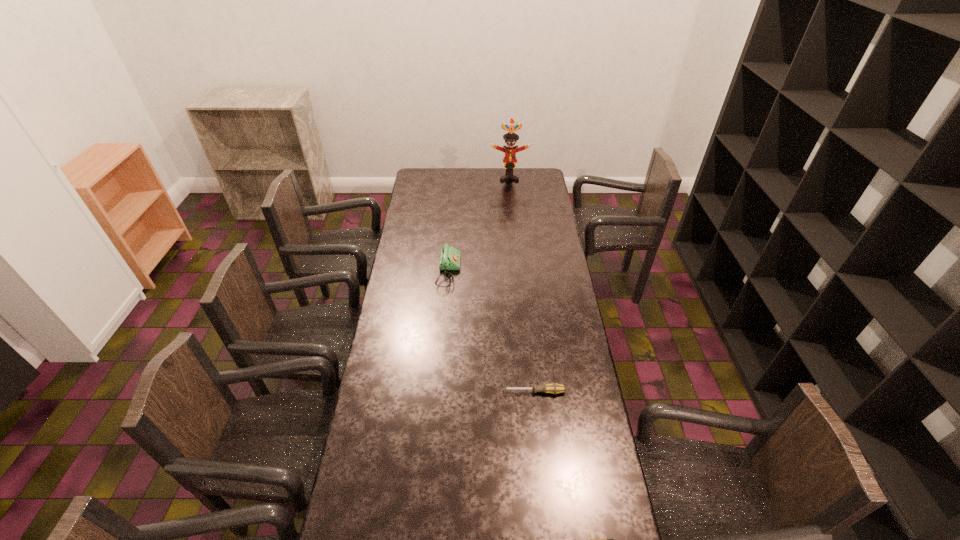
In order to click on the farthest object in this screenshot , I will do `click(509, 161)`.

This screenshot has width=960, height=540. Identify the location of the tallest object. (509, 161).

At what (x,y) coordinates should I click in order to perform the action: click on the leftmost object. Please return your answer as a coordinate pair (x, y). Looking at the image, I should click on (449, 257).

This screenshot has height=540, width=960. Identify the location of telephone. (449, 257).

I want to click on the farther screwdriver, so click(554, 388).

This screenshot has height=540, width=960. I want to click on the third tallest object, so click(554, 388).

This screenshot has height=540, width=960. I want to click on vacant area situated 0.290m on the front-facing side of the farthest object, so click(x=513, y=210).

Find the location of `vacant space situated 0.350m on the dial of the third nearest object`. vacant space situated 0.350m on the dial of the third nearest object is located at coordinates (538, 272).

Where is `free region located 0.110m at the tip of the second shortest object`? The image size is (960, 540). free region located 0.110m at the tip of the second shortest object is located at coordinates (471, 392).

This screenshot has width=960, height=540. What are the coordinates of `vacant area situated 0.110m at the tip of the second shortest object` in the screenshot? It's located at (471, 392).